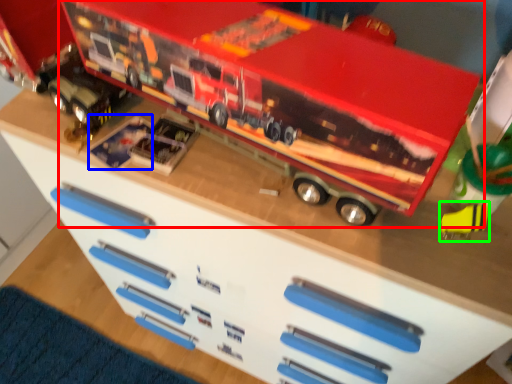
Question: Which object is positioned closest to toy (highlighted by a red box)? Select from toy (highlighted by a blue box) and toy (highlighted by a green box).

Choices:
 (A) toy
 (B) toy

Answer: (A)